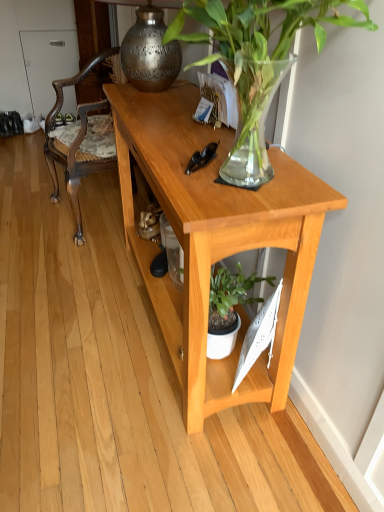
Where is `free space in front of black plastic sunglasses at center`? free space in front of black plastic sunglasses at center is located at coordinates (213, 191).